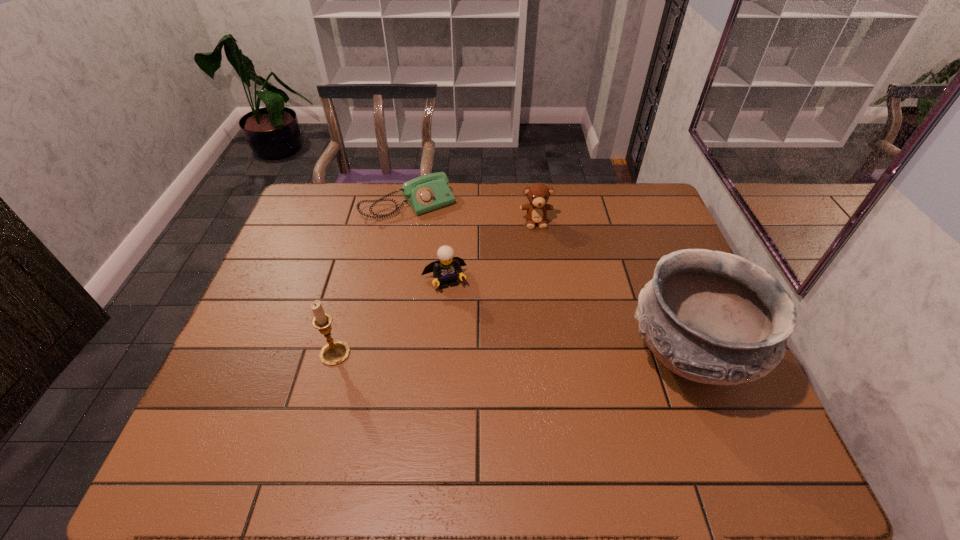
This screenshot has width=960, height=540. I want to click on vacant space on the desktop that is between the fourth shortest object and the pottery and is positioned on the face of the fourth object from left to right, so click(x=554, y=355).

Locate an element on the screen. free spot on the desktop that is between the candle holder and the rightmost object and is positioned on the front-facing side of the Lego is located at coordinates (469, 355).

Image resolution: width=960 pixels, height=540 pixels. I want to click on vacant space on the desktop that is between the fourth shortest object and the pottery and is positioned on the dial of the shortest object, so click(x=516, y=355).